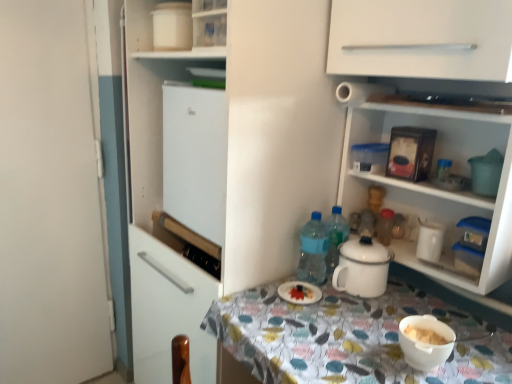
Image resolution: width=512 pixels, height=384 pixels. Find the location of `blue plastic bottle at center, marked as the second bottle in a right-to-left arrangement`. blue plastic bottle at center, marked as the second bottle in a right-to-left arrangement is located at coordinates (313, 251).

Image resolution: width=512 pixels, height=384 pixels. Describe the element at coordinates (50, 198) in the screenshot. I see `white matte door at left` at that location.

At what (x,y) coordinates should I click in order to perform the action: click on white matte cabinet at upper center. Please return your answer as a coordinate pair (x, y). Looking at the image, I should click on (422, 39).

In order to click on blue plastic bottle at center, the 1th bottle viewed from the left in this screenshot , I will do `click(313, 251)`.

You are a GUI agent. You are given a task and a screenshot of the screen. Output one action in this format:
    pyautogui.click(x=<x>, y=<y>)
    Task: Click on the cabinet that is above the white matte cabinet at upper center (from the image's perspective)
    
    Given the screenshot: What is the action you would take?
    pyautogui.click(x=176, y=52)

In terms of height, does white matte cabinet at upper center look taller or shorter compared to white matte cabinet at upper center?

Considering their sizes, white matte cabinet at upper center has more height than white matte cabinet at upper center.

Considering the relative positions of white matte cabinet at upper center and white matte cabinet at upper center in the image provided, is white matte cabinet at upper center to the right of white matte cabinet at upper center from the viewer's perspective?

Yes, white matte cabinet at upper center is to the right of white matte cabinet at upper center.

From the image's perspective, which is below, white enamel pot at center or white glossy electric kettle at right?

white enamel pot at center, from the image's perspective.

Does point (336, 283) lie in front of point (425, 249)?

That is False.

Between white enamel pot at center and white glossy electric kettle at right, which one is positioned in front?

Positioned in front is white enamel pot at center.

From a real-world perspective, is white glossy shelves at upper right physically located above or below translucent plastic bottle at upper right, marked as the first bottle in a right-to-left arrangement?

white glossy shelves at upper right is above translucent plastic bottle at upper right, marked as the first bottle in a right-to-left arrangement.

Could you tell me if white glossy shelves at upper right is turned towards translucent plastic bottle at upper right, which is the second bottle from left to right?

Yes, white glossy shelves at upper right is aimed at translucent plastic bottle at upper right, which is the second bottle from left to right.

From the image's perspective, does white glossy shelves at upper right appear lower than translucent plastic bottle at upper right, which is the second bottle from left to right?

No, from the image's perspective, white glossy shelves at upper right is not beneath translucent plastic bottle at upper right, which is the second bottle from left to right.

Locate an element on the screen. door on the left of blue plastic bottle at center, marked as the second bottle in a right-to-left arrangement is located at coordinates (50, 198).

Could you tell me if blue plastic bottle at center, marked as the second bottle in a right-to-left arrangement, is turned towards white matte door at left?

No, blue plastic bottle at center, marked as the second bottle in a right-to-left arrangement, is not facing towards white matte door at left.

From a real-world perspective, between blue plastic bottle at center, the 1th bottle viewed from the left, and white matte door at left, who is vertically lower?

white matte door at left is physically lower.

Can you confirm if white glossy electric kettle at right is positioned to the right of white matte cabinet at upper center?

Correct, you'll find white glossy electric kettle at right to the right of white matte cabinet at upper center.

Are white glossy electric kettle at right and white matte cabinet at upper center located far from each other?

white glossy electric kettle at right is near white matte cabinet at upper center, not far away.

From a real-world perspective, which object rests below the other?

From a 3D spatial view, white glossy electric kettle at right is below.

Where is `appliance below the white matte cabinet at upper center (from the image's perspective)`? This screenshot has height=384, width=512. appliance below the white matte cabinet at upper center (from the image's perspective) is located at coordinates (430, 240).

Is white glossy electric kettle at right positioned with its back to white matte door at left?

That's not correct — white glossy electric kettle at right is not looking away from white matte door at left.

Which of these two, white glossy electric kettle at right or white matte door at left, is thinner?

Thinner between the two is white matte door at left.

From the image's perspective, is white glossy electric kettle at right above white matte door at left?

No, from the image's perspective, white glossy electric kettle at right is not over white matte door at left.

Is white glossy electric kettle at right to the left of white matte door at left from the viewer's perspective?

Incorrect, white glossy electric kettle at right is not on the left side of white matte door at left.

Is white glossy plate at center taller than white matte cabinet at upper center?

In fact, white glossy plate at center may be shorter than white matte cabinet at upper center.

Based on the photo, from a real-world perspective, is white glossy plate at center positioned over white matte cabinet at upper center based on gravity?

No.

Is white glossy plate at center positioned beyond the bounds of white matte cabinet at upper center?

Indeed, white glossy plate at center is completely outside white matte cabinet at upper center.

At what (x,y) coordinates should I click in order to perform the action: click on cabinetry on the right of white glossy plate at center. Please return your answer as a coordinate pair (x, y). Looking at the image, I should click on (422, 39).

This screenshot has width=512, height=384. What are the coordinates of `cabinetry that appears in front of the white matte cabinet at upper center` in the screenshot? It's located at (422, 39).

Identify the location of appliance behind the white enamel pot at center. (430, 240).

Looking at this image, which object lies further to the anchor point white glossy electric kettle at right, white matte cabinet at upper center or blue plastic bottle at center, marked as the second bottle in a right-to-left arrangement?

white matte cabinet at upper center.

When comparing their distances from white matte door at left, does white glossy electric kettle at right or white enamel pot at center seem closer?

white enamel pot at center lies closer to white matte door at left than the other object.

From the image, which object appears to be farther from white matte cabinet at upper center, white glossy shelves at upper right or white matte cabinet at upper center?

Among the two, white glossy shelves at upper right is located further to white matte cabinet at upper center.

Considering their positions, is white enamel pot at center positioned further to white glossy plate at center than white matte door at left?

white matte door at left.

When comparing their distances from white matte door at left, does white enamel pot at center or white glossy plate at center seem closer?

white glossy plate at center lies closer to white matte door at left than the other object.

From the image, which object appears to be farther from white glossy shelves at upper right, white matte door at left or white glossy electric kettle at right?

white matte door at left is positioned further to the anchor white glossy shelves at upper right.

From the picture: When comparing their distances from blue plastic bottle at center, the 1th bottle viewed from the left, does white matte cabinet at upper center or white matte door at left seem closer?

white matte cabinet at upper center is closer to blue plastic bottle at center, the 1th bottle viewed from the left.

Looking at the image, which one is located closer to white enamel pot at center, white glossy electric kettle at right or blue plastic bottle at center, the 1th bottle viewed from the left?

blue plastic bottle at center, the 1th bottle viewed from the left, is closer to white enamel pot at center.

At what (x,y) coordinates should I click in order to perform the action: click on bottle that lies between white matte cabinet at upper center and white glossy electric kettle at right from top to bottom. Please return your answer as a coordinate pair (x, y). The width and height of the screenshot is (512, 384). Looking at the image, I should click on (385, 226).

Where is `bottle between white matte cabinet at upper center and blue plastic bottle at center, marked as the second bottle in a right-to-left arrangement, in the up-down direction`? The height and width of the screenshot is (384, 512). bottle between white matte cabinet at upper center and blue plastic bottle at center, marked as the second bottle in a right-to-left arrangement, in the up-down direction is located at coordinates (385, 226).

This screenshot has width=512, height=384. Identify the location of kitchen appliance situated between white glossy plate at center and white glossy electric kettle at right from left to right. (362, 267).

I want to click on shelf between blue plastic bottle at center, marked as the second bottle in a right-to-left arrangement, and white glossy electric kettle at right, so click(437, 187).